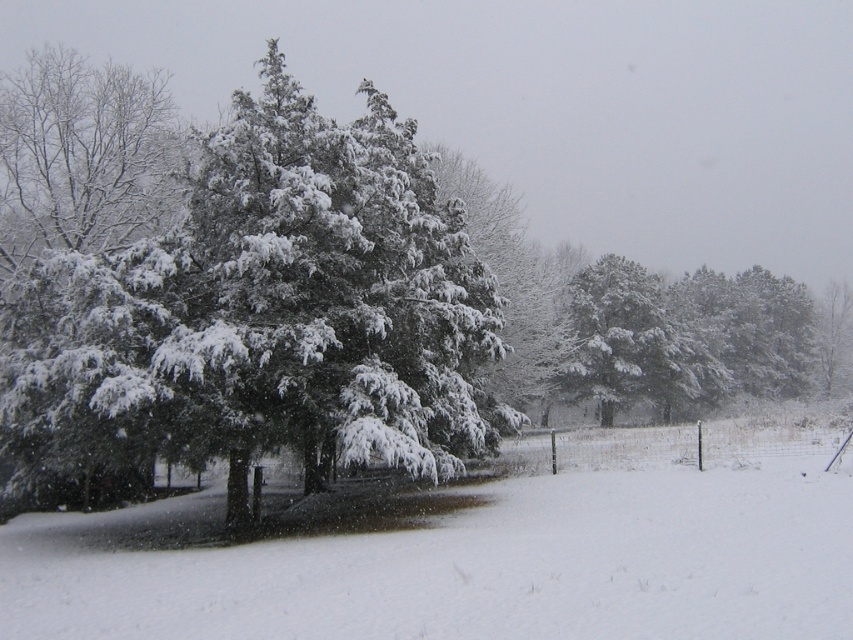
At what (x,y) coordinates should I click in order to perform the action: click on green matte tree at center. Please return your answer as a coordinate pair (x, y). The height and width of the screenshot is (640, 853). Looking at the image, I should click on (259, 321).

Between point (91, 394) and point (582, 364), which one is positioned in front?

Positioned in front is point (91, 394).

Who is more forward, (286,170) or (601,384)?

Point (286,170) is in front.

Identify the location of green matte tree at center. The image size is (853, 640). (259, 321).

How much distance is there between white fluffy snow at center and snow-covered evergreen at center?

white fluffy snow at center and snow-covered evergreen at center are 29.60 meters apart.

Between white fluffy snow at center and snow-covered evergreen at center, which one appears on the left side from the viewer's perspective?

white fluffy snow at center is more to the left.

Is point (210, 506) farther from camera compared to point (756, 328)?

No, it is not.

Where is `white fluffy snow at center`? The width and height of the screenshot is (853, 640). white fluffy snow at center is located at coordinates (474, 550).

Which is below, green matte tree at center or white fluffy snow at center?

white fluffy snow at center is below.

Does point (207, 268) come behind point (125, 573)?

Yes, point (207, 268) is farther from viewer.

Who is more distant from viewer, [297,445] or [616,600]?

Point [297,445]

This screenshot has width=853, height=640. What are the coordinates of `green matte tree at center` in the screenshot? It's located at (259, 321).